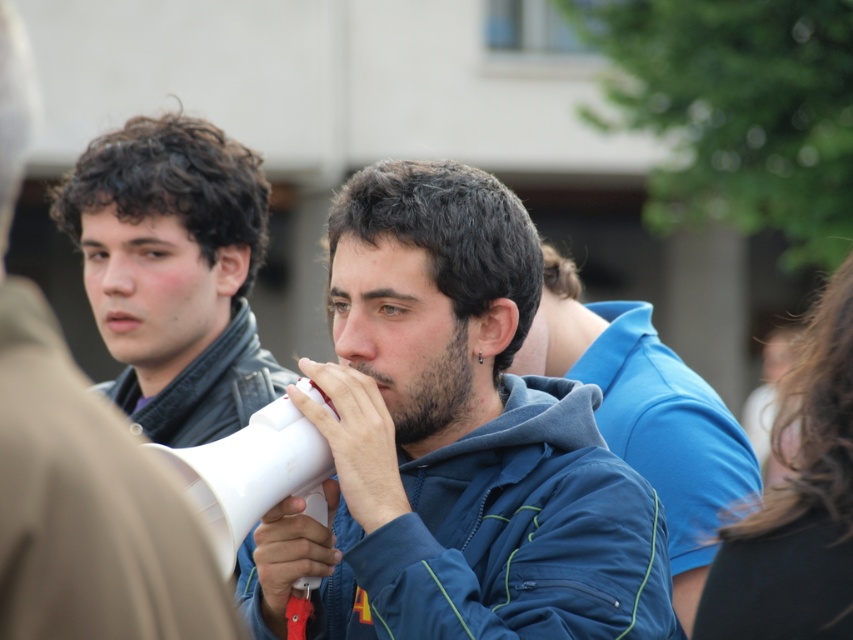
Based on the coordinates provided, which object is located at point (456,440)?

The point (456,440) marks the location of the blue fleece jacket at center.

You are a photographer standing in front of the scene. You want to take a photo that includes both point (20, 566) and point (320, 445). Which point should you focus on to ensure both are in sharp focus?

You should focus on point (320, 445) because it is farther from the camera than point (20, 566). By focusing on the farther point, the closer point will also be within the depth of field, ensuring both are sharp.

You are a photographer standing 10 feet away from the two objects in the scene. You have a camera with a lens that can focus on objects within a 10 inch range. Can you focus on both the blue fleece jacket at center and the white plastic megaphone at center at the same time?

The blue fleece jacket at center and the white plastic megaphone at center are 8.26 inches apart, which is within the 10 inch range of the camera lens. Therefore, you can focus on both objects simultaneously.